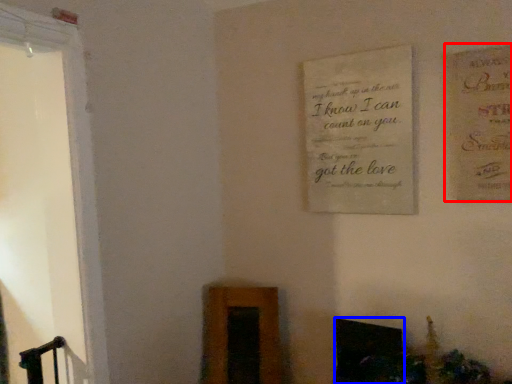
Question: Among these objects, which one is nearest to the camera, postcard (highlighted by a red box) or fireplace (highlighted by a blue box)?

Choices:
 (A) postcard
 (B) fireplace

Answer: (A)